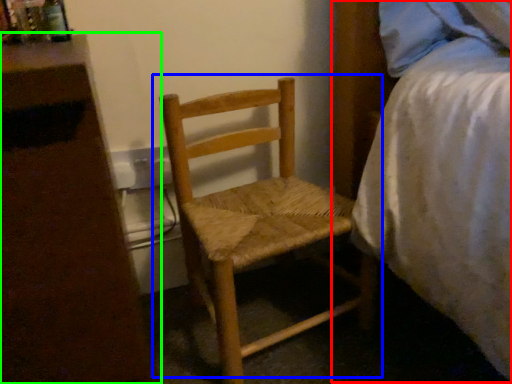
Question: Which object is the farthest from bed (highlighted by a red box)? Choose among these: chair (highlighted by a blue box) or nightstand (highlighted by a green box).

Choices:
 (A) chair
 (B) nightstand

Answer: (B)